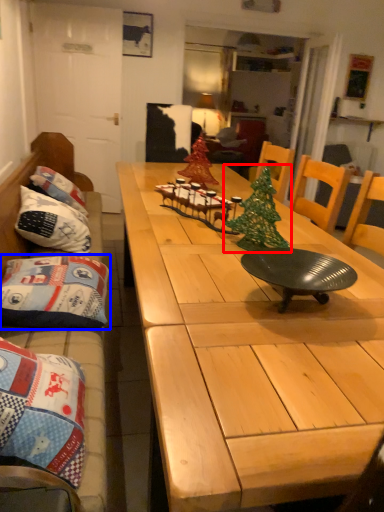
Question: Which object appears farthest to the camera in this image, christmas tree (highlighted by a red box) or pillow (highlighted by a blue box)?

Choices:
 (A) christmas tree
 (B) pillow

Answer: (B)